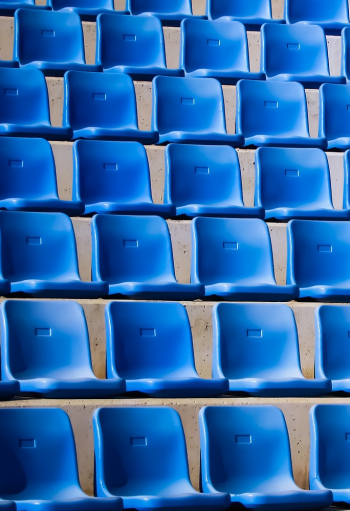
Find the location of `seats in the bottom 2 rows`. seats in the bottom 2 rows is located at coordinates (37, 466), (146, 462), (252, 463), (332, 462), (8, 389), (58, 373), (156, 364), (254, 362), (331, 357).